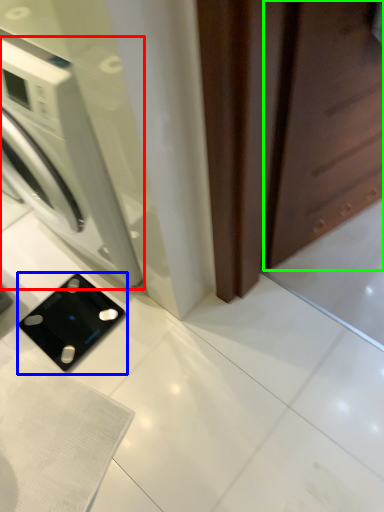
Question: Based on their relative distances, which object is nearer to washing machine (highlighted by a red box)? Choose from appliance (highlighted by a blue box) and screen door (highlighted by a green box).

Choices:
 (A) appliance
 (B) screen door

Answer: (A)